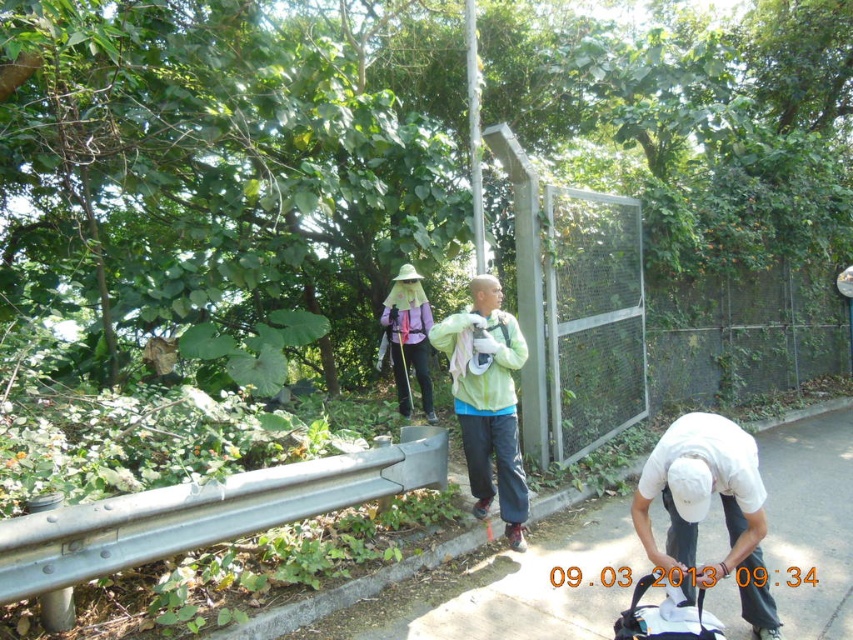
Question: Is the position of concrete pavement at center more distant than that of white matte shirt at lower right?

Choices:
 (A) no
 (B) yes

Answer: (B)

Question: Which of the following is the farthest from the observer?

Choices:
 (A) purple matte backpack at center
 (B) white fabric baby carriage at lower right

Answer: (A)

Question: Among these objects, which one is farthest from the camera?

Choices:
 (A) green matte jacket at center
 (B) concrete pavement at center
 (C) white fabric baby carriage at lower right
 (D) white matte shirt at lower right

Answer: (A)

Question: Which point is closer to the camera?

Choices:
 (A) (465, 596)
 (B) (683, 520)
 (C) (399, 272)

Answer: (B)

Question: Is white matte shirt at lower right above green matte jacket at center?

Choices:
 (A) yes
 (B) no

Answer: (B)

Question: Where is concrete pavement at center located in relation to green matte jacket at center in the image?

Choices:
 (A) below
 (B) above

Answer: (A)